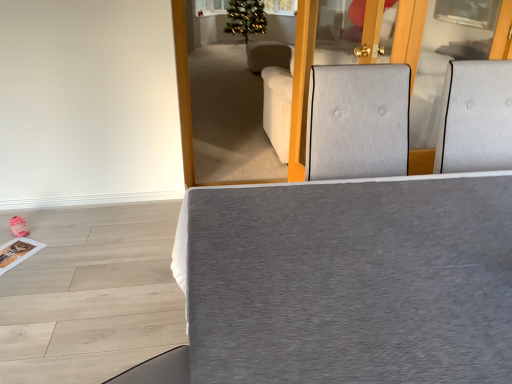
This screenshot has width=512, height=384. Describe the element at coordinates (347, 282) in the screenshot. I see `gray fabric bed at center` at that location.

Find the location of a particular element. This screenshot has width=512, height=384. gray fabric bed at center is located at coordinates pyautogui.click(x=347, y=282).

Locate an element on the screen. gray fabric bed at center is located at coordinates (347, 282).